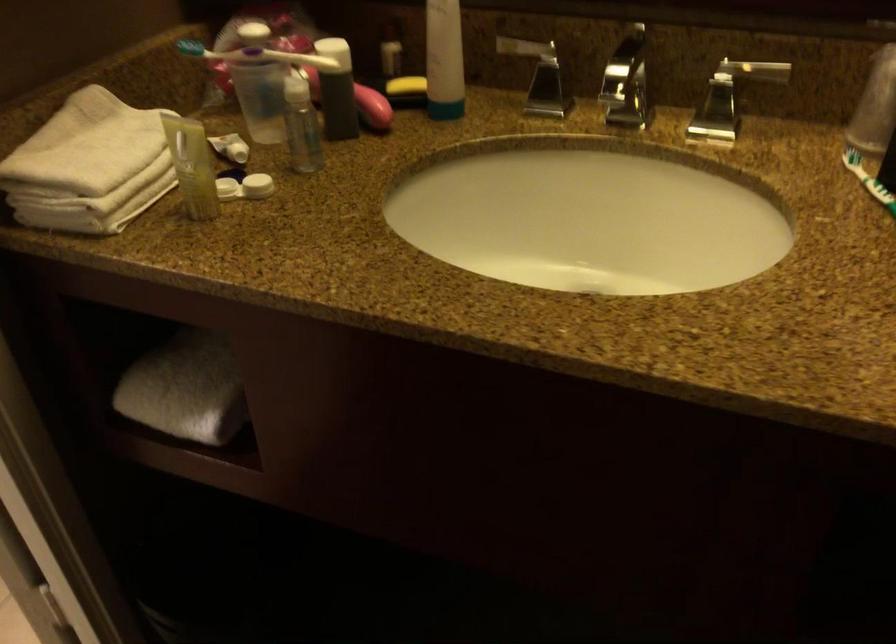
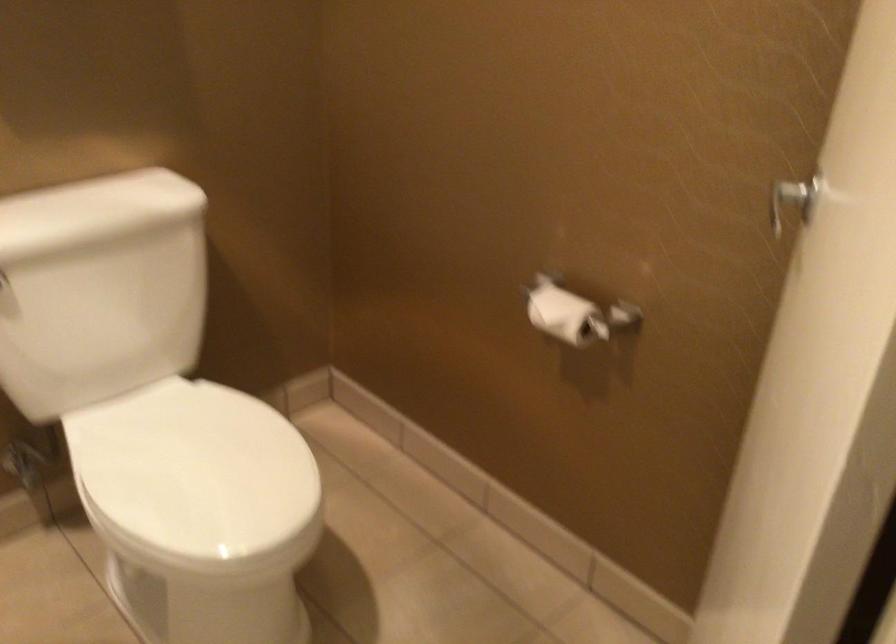
Question: What movement of the cameraman would produce the second image?

Choices:
 (A) Left
 (B) Right
 (C) Forward
 (D) Backward

Answer: (A)